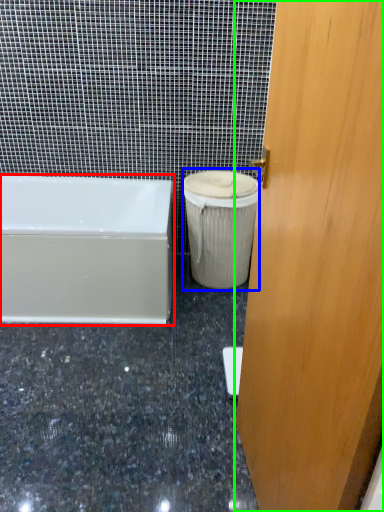
Question: Which object is the farthest from bathtub (highlighted by a red box)? Choose among these: garbage (highlighted by a blue box) or door (highlighted by a green box).

Choices:
 (A) garbage
 (B) door

Answer: (B)